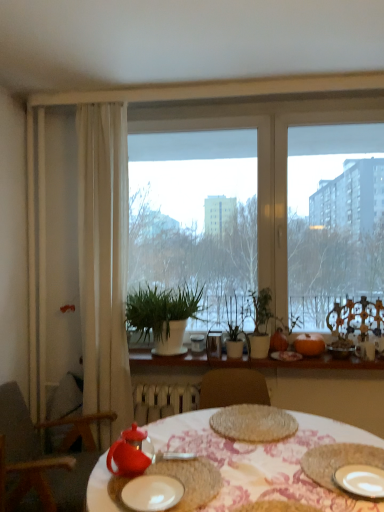
Locate an element on the screen. free spot above rustic woven placemat at lower right (from a real-world perspective) is located at coordinates (352, 460).